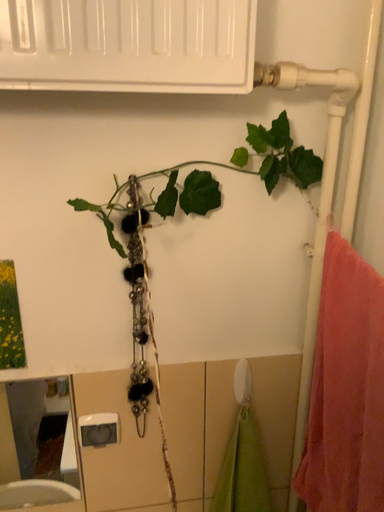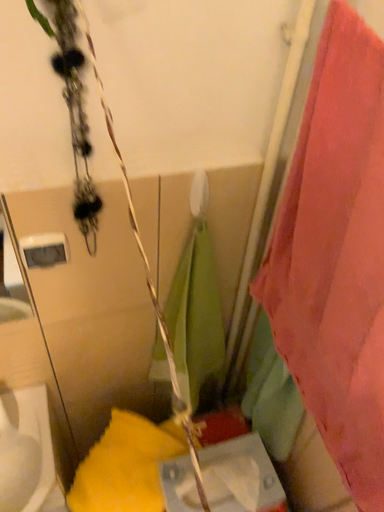
Question: Which way did the camera rotate in the video?

Choices:
 (A) rotated right
 (B) rotated left

Answer: (A)